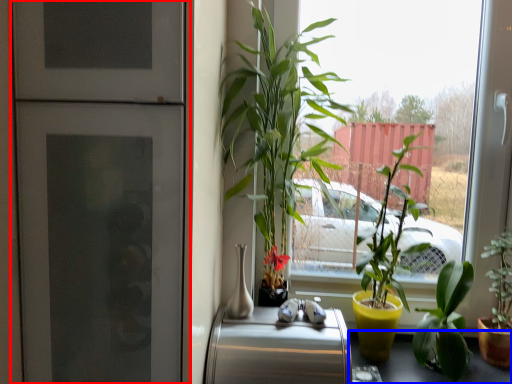
Question: Which point is closer to the camera, fridge (highlighted by a red box) or table (highlighted by a blue box)?

Choices:
 (A) fridge
 (B) table

Answer: (A)